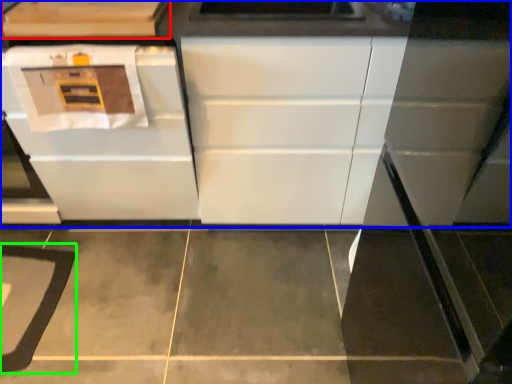
Question: Considering the real-world distances, which object is farthest from cabinetry (highlighted by a red box)? cabinetry (highlighted by a blue box) or mat (highlighted by a green box)?

Choices:
 (A) cabinetry
 (B) mat

Answer: (B)